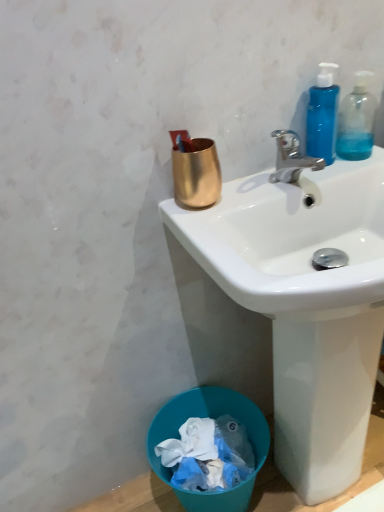
Question: In the image, is gold metallic cup at upper center positioned in front of or behind blue translucent bottle at upper right, which is the first bottle in left-to-right order?

Choices:
 (A) behind
 (B) front

Answer: (B)

Question: Is gold metallic cup at upper center inside the boundaries of blue translucent bottle at upper right, the 2th bottle viewed from the right, or outside?

Choices:
 (A) outside
 (B) inside

Answer: (A)

Question: Which object is the farthest from the white glossy sink at upper center?

Choices:
 (A) transparent plastic bottle at upper right, the 2th bottle viewed from the left
 (B) blue translucent bottle at upper right, the 2th bottle viewed from the right
 (C) gold metallic cup at upper center
 (D) blue plastic trash bin at lower left
 (E) polished chrome faucet at upper right

Answer: (A)

Question: Estimate the real-world distances between objects in this image. Which object is farther from the transparent plastic bottle at upper right, the 2th bottle viewed from the left?

Choices:
 (A) gold metallic cup at upper center
 (B) blue translucent bottle at upper right, the 2th bottle viewed from the right
 (C) white glossy sink at upper center
 (D) blue plastic trash bin at lower left
 (E) polished chrome faucet at upper right

Answer: (D)